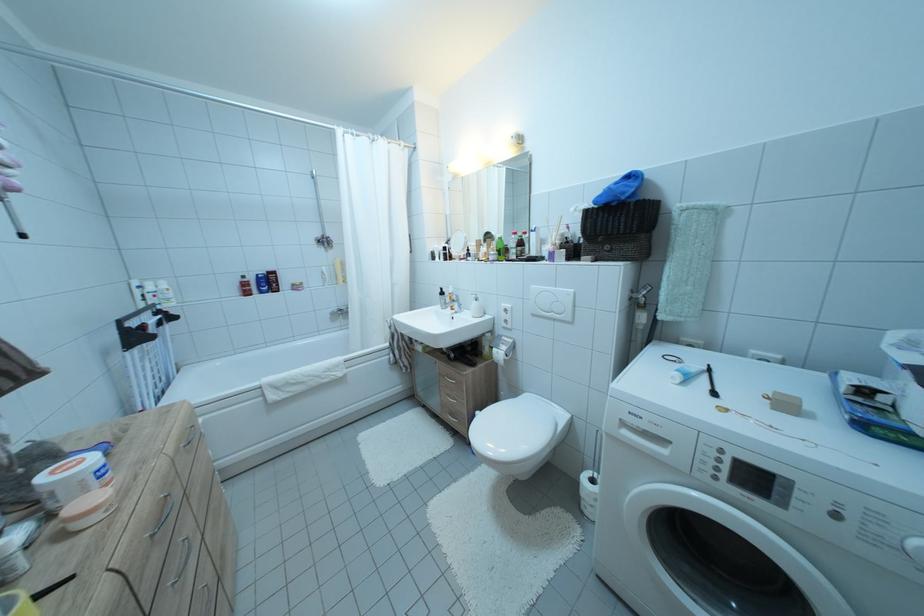
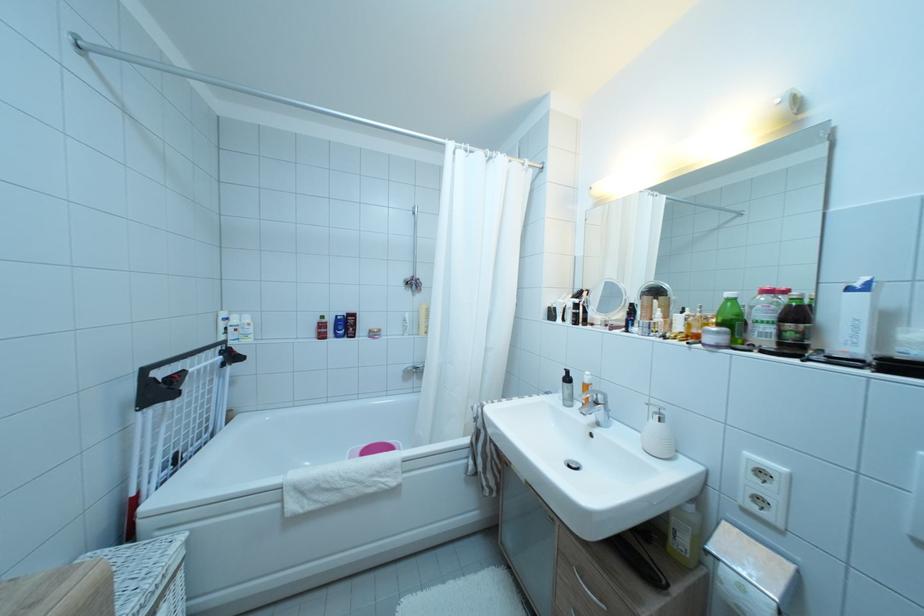
Where in the second image is the point corresponding to point 454,300 from the first image?

(585, 390)